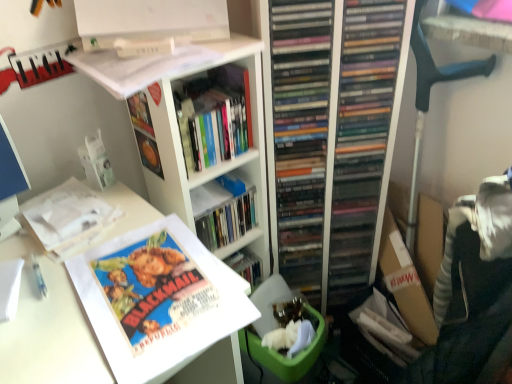
Question: Considering the positions of white matte bookshelf at upper center and white paper at upper left, which appears as the 2th book when ordered from the bottom, in the image, is white matte bookshelf at upper center wider or thinner than white paper at upper left, which appears as the 2th book when ordered from the bottom,?

Choices:
 (A) thin
 (B) wide

Answer: (B)

Question: From their relative heights in the image, would you say white matte bookshelf at upper center is taller or shorter than white paper at upper left, which appears as the 2th book when ordered from the bottom?

Choices:
 (A) short
 (B) tall

Answer: (B)

Question: Which object is the farthest from the matte paper poster at lower left, placed as the 1th book when sorted from bottom to top?

Choices:
 (A) hardcover book at center, the first book from the top
 (B) white matte bookshelf at upper center
 (C) black plastic computer chair at right
 (D) white paper at upper left, acting as the 2th book starting from the top

Answer: (C)

Question: Estimate the real-world distances between objects in this image. Which object is closer to the white matte bookshelf at upper center?

Choices:
 (A) white paper at upper left, which appears as the 2th book when ordered from the bottom
 (B) matte paper poster at lower left, which appears as the third book when viewed from the top
 (C) black plastic computer chair at right
 (D) hardcover book at center, placed as the third book when sorted from bottom to top

Answer: (D)